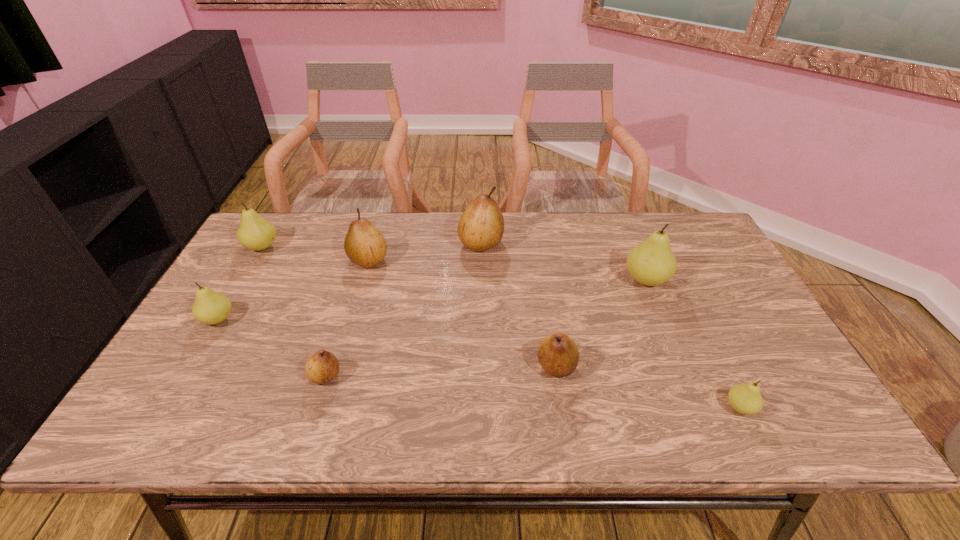
Identify the location of object that stands as the closest to the third nearest green pear. Image resolution: width=960 pixels, height=540 pixels. (558, 354).

Locate which object is the seventh closest to the biggest green pear. Please provide its 2D coordinates. Your answer should be formatted as a tuple, i.e. [(x, y)], where the tuple contains the x and y coordinates of a point satisfying the conditions above.

[(210, 307)]

Where is `pear that is the seventh closest to the biggest green pear`? pear that is the seventh closest to the biggest green pear is located at coordinates (210, 307).

Identify the location of pear that stands as the fifth closest to the nearest object. (365, 245).

Locate which brown pear is the closest to the biggest green pear. Please provide its 2D coordinates. Your answer should be formatted as a tuple, i.e. [(x, y)], where the tuple contains the x and y coordinates of a point satisfying the conditions above.

[(558, 354)]

Identify which brown pear is the third closest to the smallest brown pear. Please provide its 2D coordinates. Your answer should be formatted as a tuple, i.e. [(x, y)], where the tuple contains the x and y coordinates of a point satisfying the conditions above.

[(481, 226)]

This screenshot has height=540, width=960. Identify the location of green pear that stands as the second closest to the fifth pear from left to right. (255, 233).

You are a GUI agent. You are given a task and a screenshot of the screen. Output one action in this format:
    pyautogui.click(x=<x>, y=<y>)
    Task: Click on the green pear object that ranks as the third closest to the smallest brown pear
    This screenshot has height=540, width=960.
    Given the screenshot: What is the action you would take?
    pyautogui.click(x=651, y=262)

At what (x,y) coordinates should I click in order to perform the action: click on free location that satisfies the following two spatial constraints: 1. on the front side of the third pear from right to left; 2. on the left side of the nearest object. Please return your answer as a coordinate pair (x, y). Looking at the image, I should click on (563, 407).